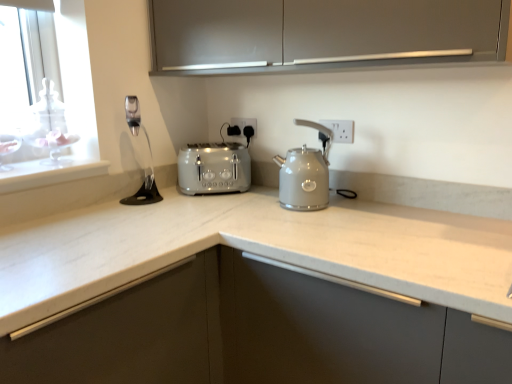
Find the location of `satin finish cabinet at upper center`. satin finish cabinet at upper center is located at coordinates (321, 33).

Describe the element at coordinates (245, 123) in the screenshot. Image resolution: width=512 pixels, height=384 pixels. I see `white plastic electric outlet at upper center, placed as the second electric outlet when sorted from right to left` at that location.

At what (x,y) coordinates should I click in order to perform the action: click on satin nickel faucet at upper left. Please return your answer as a coordinate pair (x, y). Looking at the image, I should click on (133, 114).

Could you measure the distance between white plastic electric outlet at upper right, the 1th electric outlet viewed from the right, and satin nickel faucet at upper left?

30.64 inches.

Considering the relative sizes of white plastic electric outlet at upper right, positioned as the first electric outlet in front-to-back order, and satin nickel faucet at upper left in the image provided, is white plastic electric outlet at upper right, positioned as the first electric outlet in front-to-back order, wider than satin nickel faucet at upper left?

Incorrect, the width of white plastic electric outlet at upper right, positioned as the first electric outlet in front-to-back order, does not surpass that of satin nickel faucet at upper left.

Where is `electric outlet in front of the satin nickel faucet at upper left`? The image size is (512, 384). electric outlet in front of the satin nickel faucet at upper left is located at coordinates (340, 130).

From the image's perspective, is white plastic electric outlet at upper right, the 1th electric outlet viewed from the right, above satin nickel faucet at upper left?

No, from the image's perspective, white plastic electric outlet at upper right, the 1th electric outlet viewed from the right, is not over satin nickel faucet at upper left.

From the picture: Is white plastic electric outlet at upper center, acting as the 1th electric outlet starting from the left, inside the boundaries of satin silver toaster at center, or outside?

The correct answer is: outside.

Would you consider white plastic electric outlet at upper center, placed as the second electric outlet when sorted from right to left, to be distant from satin silver toaster at center?

They are positioned close to each other.

In the scene shown: Which object is wider, white plastic electric outlet at upper center, which appears as the first electric outlet when viewed from the back, or satin silver toaster at center?

satin silver toaster at center.

Is white plastic electric outlet at upper center, acting as the 1th electric outlet starting from the left, oriented away from satin silver toaster at center?

No, white plastic electric outlet at upper center, acting as the 1th electric outlet starting from the left, is not facing away from satin silver toaster at center.

Is satin nickel faucet at upper left wider than white plastic electric outlet at upper center, which appears as the second electric outlet when viewed from the front?

Yes.

From the picture: Is satin nickel faucet at upper left positioned with its back to white plastic electric outlet at upper center, which appears as the second electric outlet when viewed from the front?

No, satin nickel faucet at upper left is not facing away from white plastic electric outlet at upper center, which appears as the second electric outlet when viewed from the front.

From the image's perspective, is satin nickel faucet at upper left beneath white plastic electric outlet at upper center, placed as the second electric outlet when sorted from right to left?

Actually, satin nickel faucet at upper left appears above white plastic electric outlet at upper center, placed as the second electric outlet when sorted from right to left, in the image.

Considering the sizes of objects satin grey kettle at center and satin nickel faucet at upper left in the image provided, who is shorter, satin grey kettle at center or satin nickel faucet at upper left?

With less height is satin nickel faucet at upper left.

Can you confirm if satin grey kettle at center is positioned to the left of satin nickel faucet at upper left?

In fact, satin grey kettle at center is to the right of satin nickel faucet at upper left.

Is satin grey kettle at center not close to satin nickel faucet at upper left?

No.

Who is taller, satin nickel faucet at upper left or satin grey kettle at center?

Standing taller between the two is satin grey kettle at center.

I want to click on faucet above the satin grey kettle at center (from a real-world perspective), so click(133, 114).

Which object is closer to the camera taking this photo, satin nickel faucet at upper left or satin grey kettle at center?

Positioned in front is satin grey kettle at center.

Considering the positions of objects white plastic electric outlet at upper right, the second electric outlet in the left-to-right sequence, and satin finish cabinet at upper center in the image provided, who is in front, white plastic electric outlet at upper right, the second electric outlet in the left-to-right sequence, or satin finish cabinet at upper center?

satin finish cabinet at upper center is closer to the camera.

Which point is more distant from viewer, (349, 123) or (264, 71)?

Point (264, 71)

Can you confirm if white plastic electric outlet at upper right, the second electric outlet in the left-to-right sequence, is positioned to the right of satin finish cabinet at upper center?

Yes, white plastic electric outlet at upper right, the second electric outlet in the left-to-right sequence, is to the right of satin finish cabinet at upper center.

Measure the distance from white plastic electric outlet at upper right, positioned as the first electric outlet in front-to-back order, to satin finish cabinet at upper center.

white plastic electric outlet at upper right, positioned as the first electric outlet in front-to-back order, and satin finish cabinet at upper center are 51.31 centimeters apart.

Is satin finish cabinet at upper center in front of satin silver toaster at center?

Yes, satin finish cabinet at upper center is closer to the camera.

Are satin finish cabinet at upper center and satin silver toaster at center beside each other?

They are not placed beside each other.

Considering the relative sizes of satin finish cabinet at upper center and satin silver toaster at center in the image provided, is satin finish cabinet at upper center shorter than satin silver toaster at center?

No, satin finish cabinet at upper center is not shorter than satin silver toaster at center.

The image size is (512, 384). I want to click on cabinetry located on the right of satin silver toaster at center, so click(x=321, y=33).

Locate an element on the screen. This screenshot has width=512, height=384. electric outlet in front of the satin nickel faucet at upper left is located at coordinates (340, 130).

From the image's perspective, which electric outlet is the 2nd one above the satin silver toaster at center? Please provide its 2D coordinates.

[(245, 123)]

Estimate the real-world distances between objects in this image. Which object is further from satin finish cabinet at upper center, satin grey kettle at center or satin silver toaster at center?

satin silver toaster at center is further to satin finish cabinet at upper center.

Estimate the real-world distances between objects in this image. Which object is closer to white plastic electric outlet at upper center, which appears as the first electric outlet when viewed from the back, satin silver toaster at center or satin finish cabinet at upper center?

satin silver toaster at center.

From the image, which object appears to be nearer to satin nickel faucet at upper left, satin finish cabinet at upper center or satin grey kettle at center?

The object closer to satin nickel faucet at upper left is satin finish cabinet at upper center.

Estimate the real-world distances between objects in this image. Which object is further from satin silver toaster at center, satin finish cabinet at upper center or satin nickel faucet at upper left?

Among the two, satin finish cabinet at upper center is located further to satin silver toaster at center.

Based on their spatial positions, is satin grey kettle at center or satin nickel faucet at upper left closer to white plastic electric outlet at upper center, which appears as the first electric outlet when viewed from the back?

satin grey kettle at center is positioned closer to the anchor white plastic electric outlet at upper center, which appears as the first electric outlet when viewed from the back.

When comparing their distances from white plastic electric outlet at upper center, which appears as the first electric outlet when viewed from the back, does satin silver toaster at center or satin grey kettle at center seem further?

Among the two, satin grey kettle at center is located further to white plastic electric outlet at upper center, which appears as the first electric outlet when viewed from the back.

Estimate the real-world distances between objects in this image. Which object is further from satin finish cabinet at upper center, white plastic electric outlet at upper center, acting as the 1th electric outlet starting from the left, or white plastic electric outlet at upper right, positioned as the first electric outlet in front-to-back order?

white plastic electric outlet at upper center, acting as the 1th electric outlet starting from the left, lies further to satin finish cabinet at upper center than the other object.

Considering their positions, is satin finish cabinet at upper center positioned further to white plastic electric outlet at upper center, which appears as the second electric outlet when viewed from the front, than white plastic electric outlet at upper right, the second electric outlet in the left-to-right sequence?

The object further to white plastic electric outlet at upper center, which appears as the second electric outlet when viewed from the front, is satin finish cabinet at upper center.

Locate an element on the screen. The image size is (512, 384). electric outlet positioned between satin finish cabinet at upper center and satin silver toaster at center from near to far is located at coordinates (340, 130).

Find the location of a particular element. The width and height of the screenshot is (512, 384). kitchen appliance positioned between satin finish cabinet at upper center and white plastic electric outlet at upper right, the second electric outlet in the left-to-right sequence, from near to far is located at coordinates (305, 173).

Identify the location of faucet between satin finish cabinet at upper center and white plastic electric outlet at upper center, acting as the 1th electric outlet starting from the left, in the front-back direction. Image resolution: width=512 pixels, height=384 pixels. (133, 114).

Where is `toaster situated between satin nickel faucet at upper left and satin grey kettle at center from left to right`? toaster situated between satin nickel faucet at upper left and satin grey kettle at center from left to right is located at coordinates (214, 168).